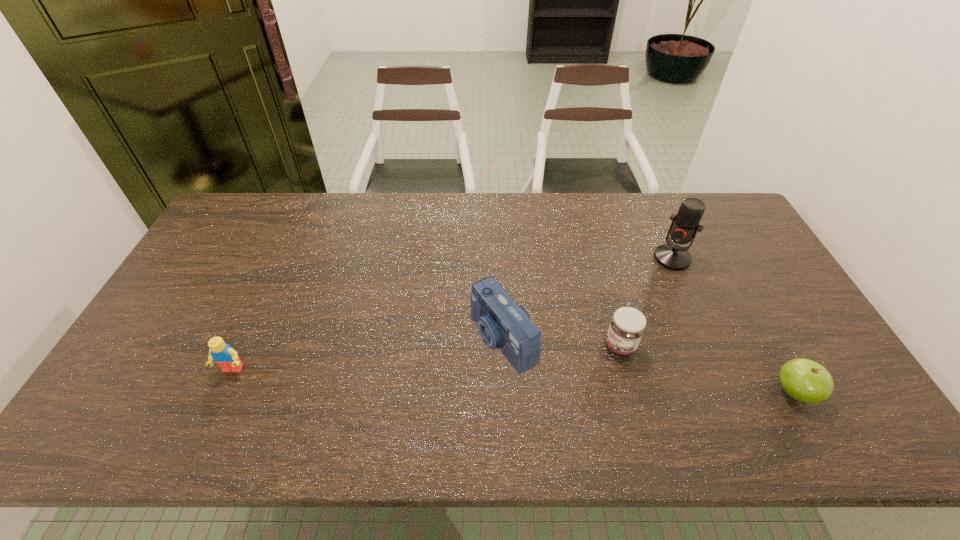
Find the location of a particular element. This screenshot has width=960, height=540. vacant space that satisfies the following two spatial constraints: 1. on the front-facing side of the rightmost object; 2. on the left side of the Lego is located at coordinates pyautogui.click(x=223, y=392).